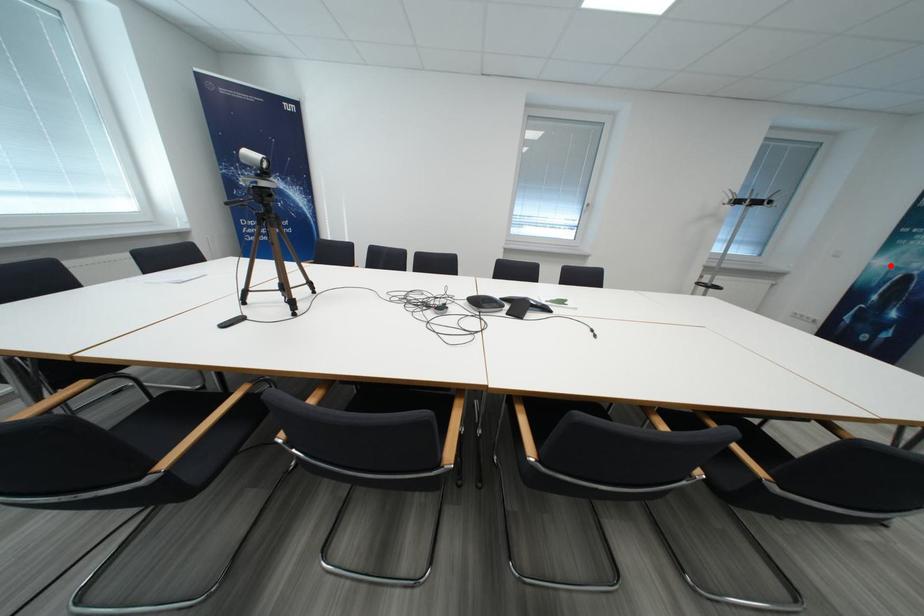
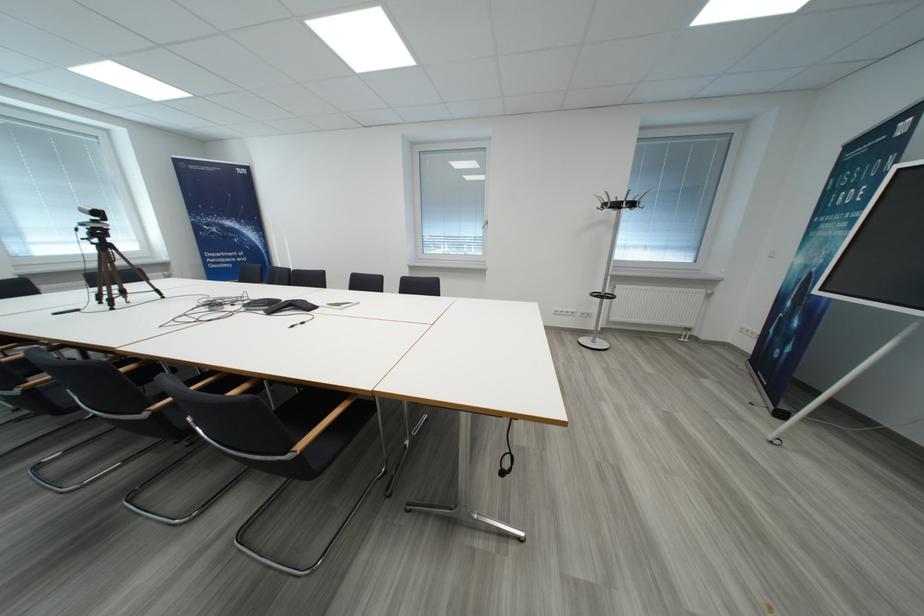
In the second image, find the point that corresponds to the highlighted location in the first image.

(807, 264)